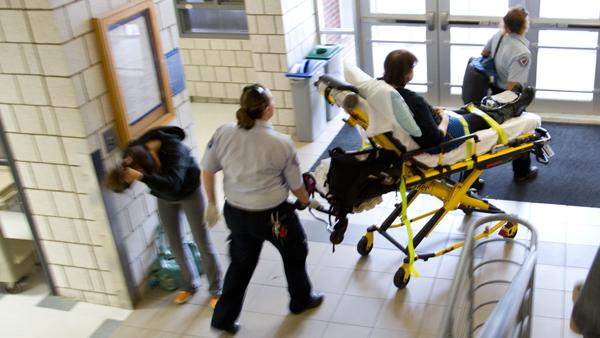
Identify the location of mat. (550, 178).